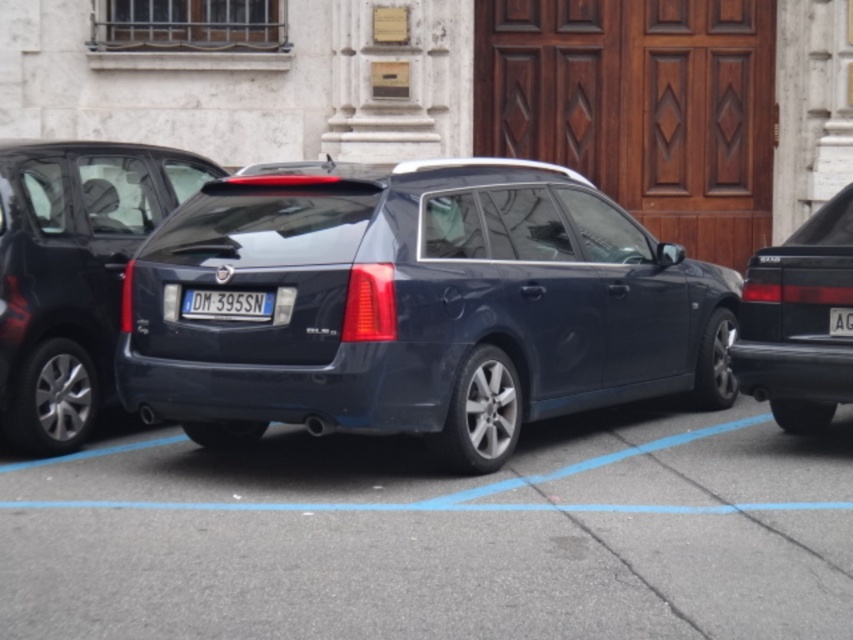
You are a delivery driver who needs to park your vehicle between two cars in the parking lot. You have a standard size truck. The glossy dark blue car at center and the satin black minivan at center are already parked. Which car should you park next to if you want to maximize space efficiency?

You should park next to the satin black minivan at center because it is smaller in size than the glossy dark blue car at center, allowing for better space efficiency.